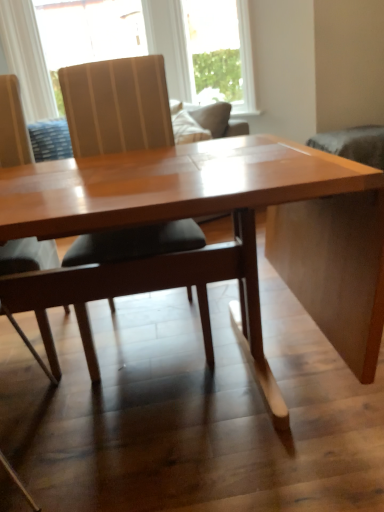
Where is `vacant area that is in front of matte wood chair at center, positioned as the second chair in left-to-right order`? This screenshot has height=512, width=384. vacant area that is in front of matte wood chair at center, positioned as the second chair in left-to-right order is located at coordinates pos(164,416).